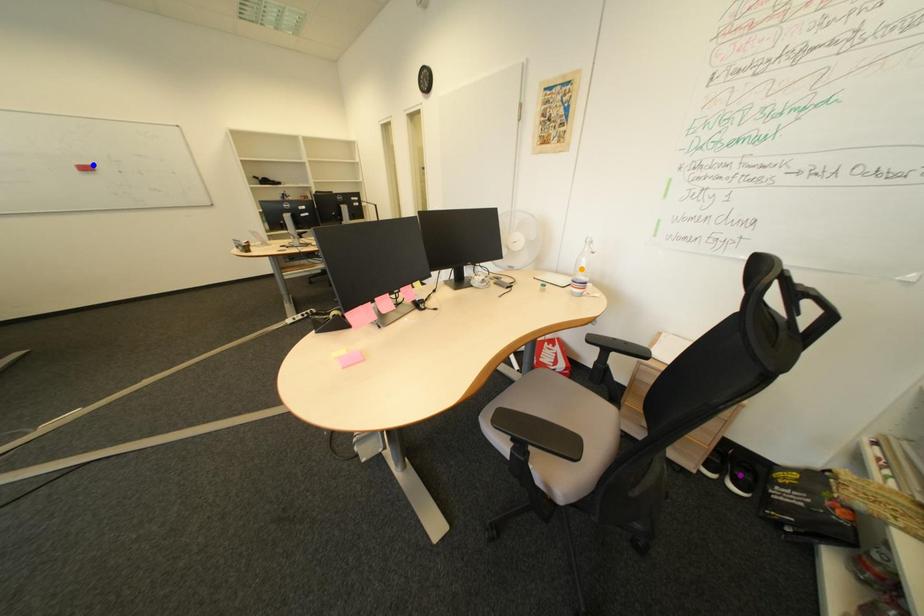
Order these from nearest to farthest:
orange point
blue point
purple point

purple point < orange point < blue point